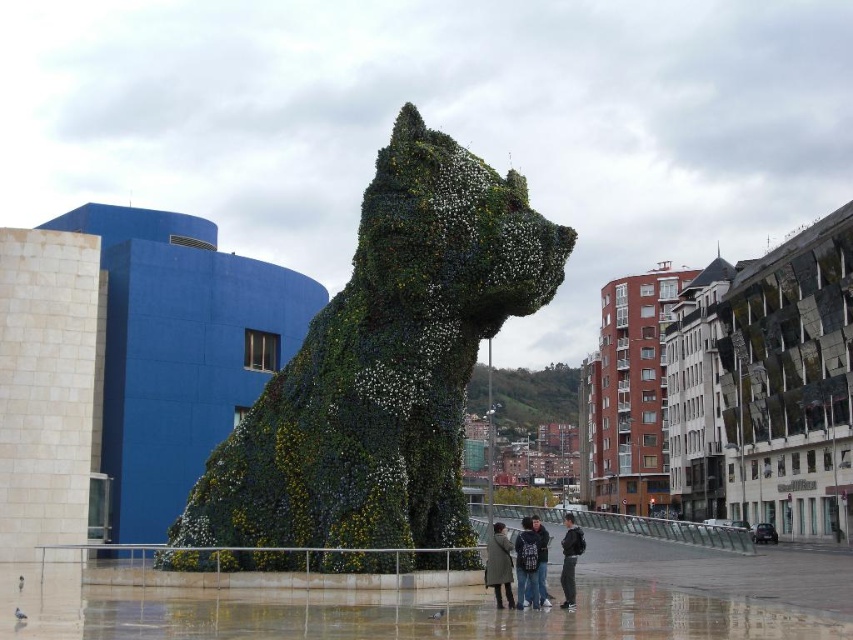
You are a fashion designer observing the urban scene. You notice the green wool coat at center and the dark gray jacket at lower center. Which clothing item is positioned closer to the viewer?

The green wool coat at center is positioned closer to the viewer as it is in front of the dark gray jacket at lower center.

You are standing in the plaza and want to take a photo of the green topiary sculpture. There are two points marked in the image at coordinates point (244, 557) and point (523, 538). Which point is closer to you when you are facing the sculpture?

Point (244, 557) is closer to you because it is further to the camera than point (523, 538), meaning it appears nearer in the image.